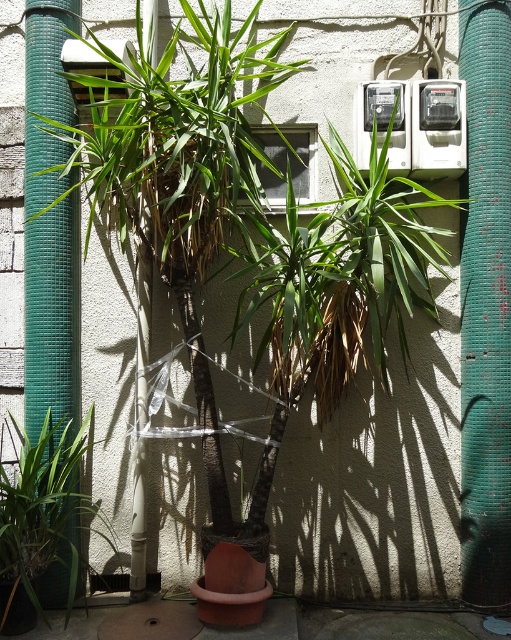
You are a gardener who wants to place a new small decorative item next to the green mesh pipe at left and the green matte plant at lower left. Which object should you place the item closer to if you want it to be proportionally larger in the scene?

You should place the item closer to the green mesh pipe at left because it has a smaller size compared to the green matte plant at lower left, making the item appear larger in proportion when placed near the smaller object.

You are a gardener who needs to water the green matte plant at lower left. You have a watering can that can spray water up to 24 centimeters. If you stand next to the green mesh pipe at left, can you reach the plant without moving closer?

The distance between the green mesh pipe at left and the green matte plant at lower left is 23.99 centimeters, which is just under the watering can spray range of 24 centimeters. Therefore, you can water the green matte plant at lower left from the green mesh pipe at left without moving closer.